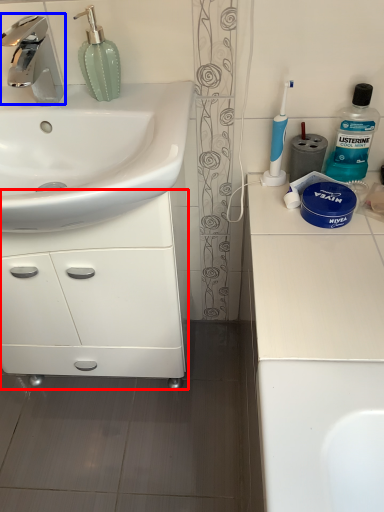
Question: Among these objects, which one is nearest to the camera, bathroom cabinet (highlighted by a red box) or tap (highlighted by a blue box)?

Choices:
 (A) bathroom cabinet
 (B) tap

Answer: (B)